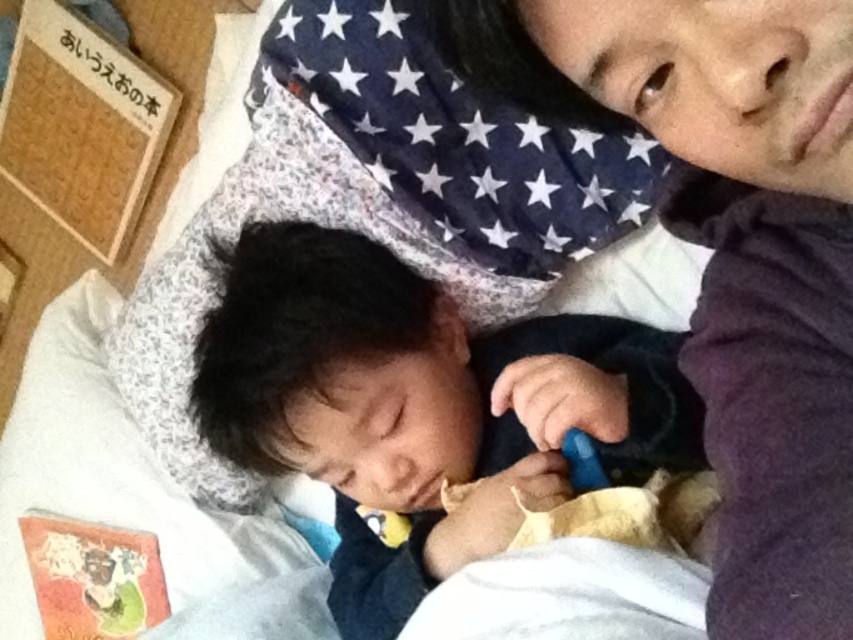
You are a caregiver trying to decide which item to use for a baby swaddle. You have the purple soft fabric at upper right and the black soft baby at center. Which item is thinner and more suitable for swaddling?

The purple soft fabric at upper right is thinner than the black soft baby at center, making it more suitable for swaddling.

You are a photographer taking a portrait of the black soft baby at center and the purple soft fabric at upper right. Which object is shorter in height?

The purple soft fabric at upper right has a lesser height compared to the black soft baby at center, so the purple soft fabric at upper right is shorter in height.